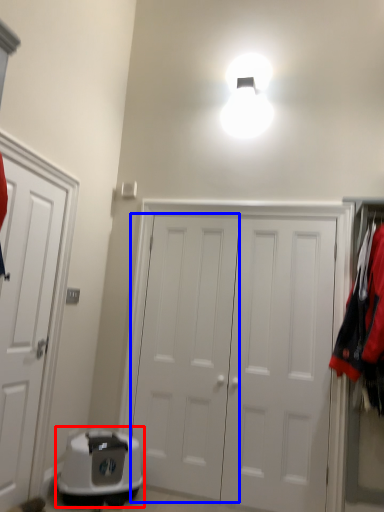
Question: Which point is further to the camera, appliance (highlighted by a red box) or door (highlighted by a blue box)?

Choices:
 (A) appliance
 (B) door

Answer: (B)